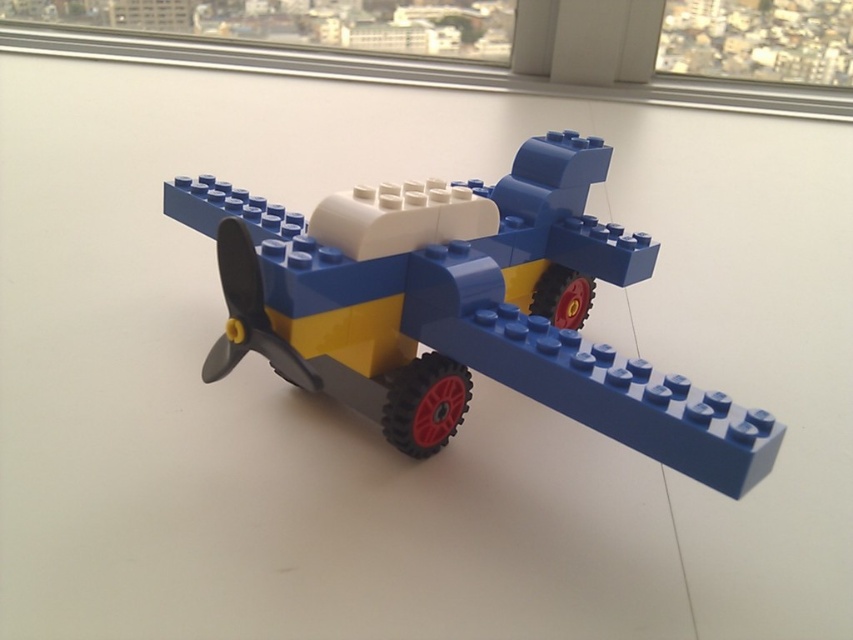
Looking at this image, can you confirm if blue plastic airplane at center is bigger than transparent glass window at upper right?

Yes.

Which of these two, blue plastic airplane at center or transparent glass window at upper right, stands shorter?

With less height is transparent glass window at upper right.

What do you see at coordinates (461, 307) in the screenshot? I see `blue plastic airplane at center` at bounding box center [461, 307].

Identify the location of blue plastic airplane at center. (461, 307).